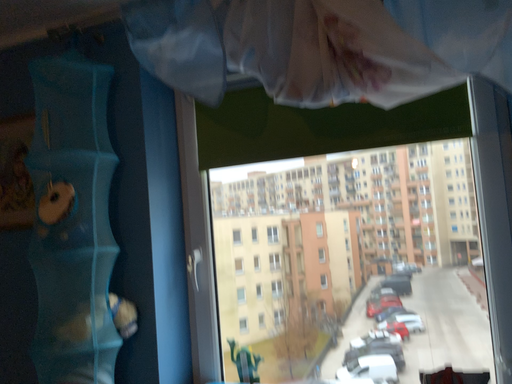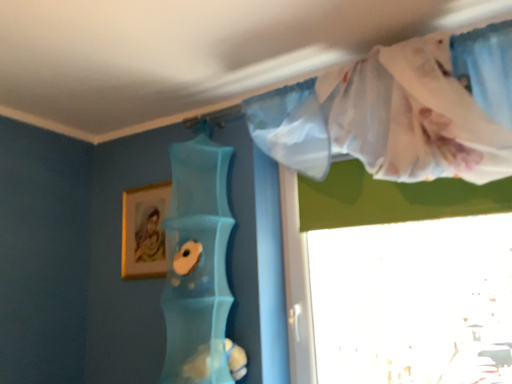
Question: Which way did the camera rotate in the video?

Choices:
 (A) rotated right
 (B) rotated left

Answer: (B)